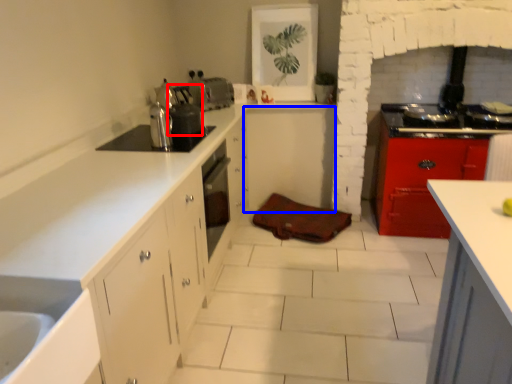
Question: Which point is further to the camera, appliance (highlighted by a red box) or cabinetry (highlighted by a blue box)?

Choices:
 (A) appliance
 (B) cabinetry

Answer: (B)